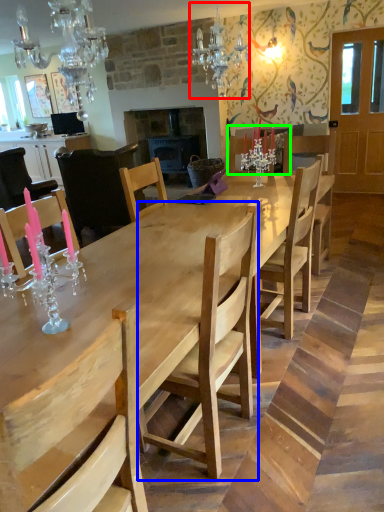
Question: Considering the real-world distances, which object is closest to light fixture (highlighted by a red box)? chair (highlighted by a blue box) or chair (highlighted by a green box).

Choices:
 (A) chair
 (B) chair

Answer: (B)